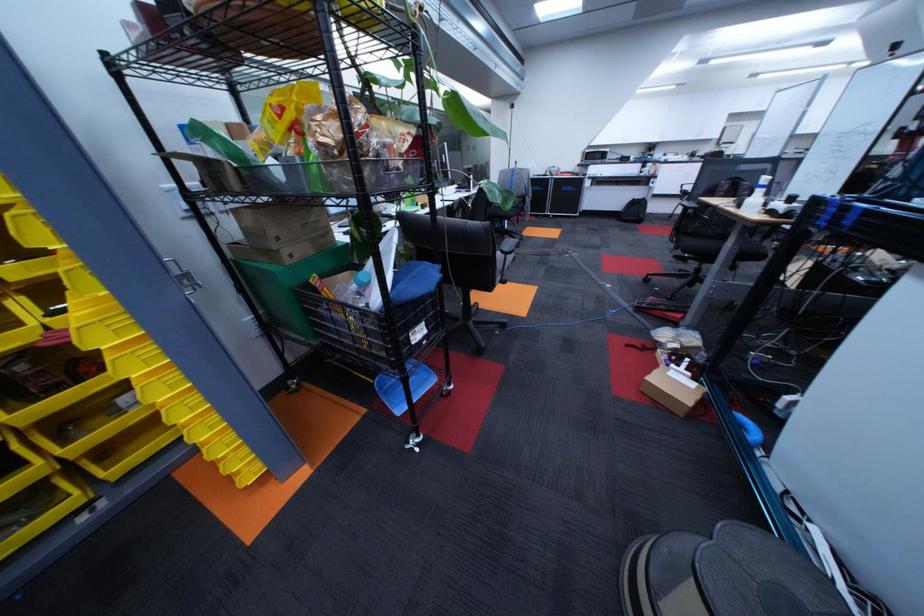
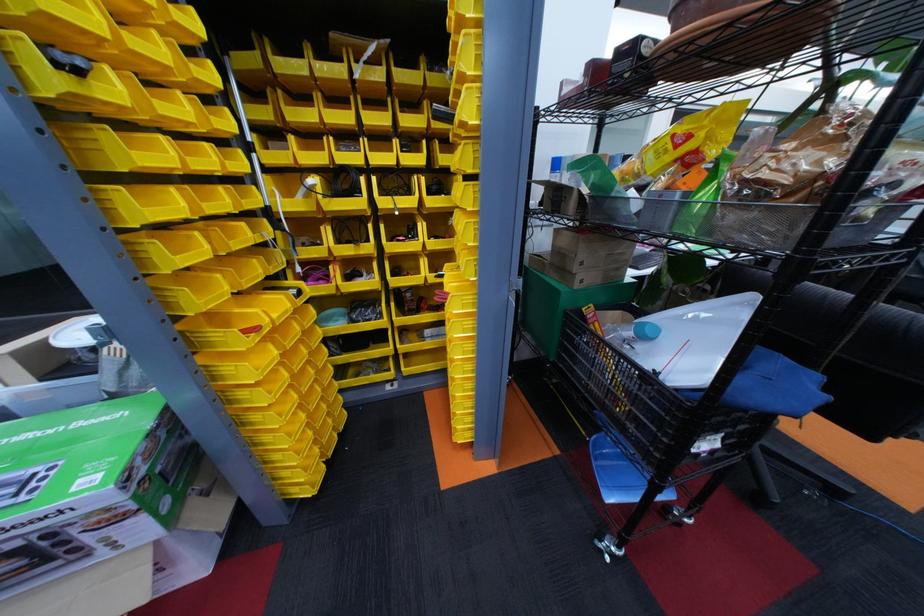
Locate, in the second image, the point that corresponds to (296,108) in the first image.

(702, 138)